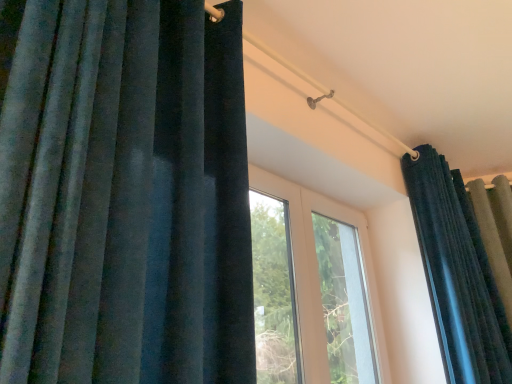
Question: Relative to velvet dark blue curtain at upper right, which appears as the first curtain when viewed from the right, is transparent glass window at center in front or behind?

Choices:
 (A) front
 (B) behind

Answer: (B)

Question: Considering the positions of transparent glass window at center and velvet dark blue curtain at upper right, which appears as the first curtain when viewed from the right, in the image, is transparent glass window at center taller or shorter than velvet dark blue curtain at upper right, which appears as the first curtain when viewed from the right,?

Choices:
 (A) tall
 (B) short

Answer: (B)

Question: Which is farther from the velvet dark blue curtain at left, which is counted as the second curtain, starting from the right?

Choices:
 (A) transparent glass window at center
 (B) velvet dark blue curtain at upper right, which appears as the second curtain when viewed from the front

Answer: (A)

Question: Estimate the real-world distances between objects in this image. Which object is closer to the velvet dark blue curtain at left, which ranks as the 1th curtain in left-to-right order?

Choices:
 (A) transparent glass window at center
 (B) velvet dark blue curtain at upper right, which appears as the first curtain when viewed from the right

Answer: (B)